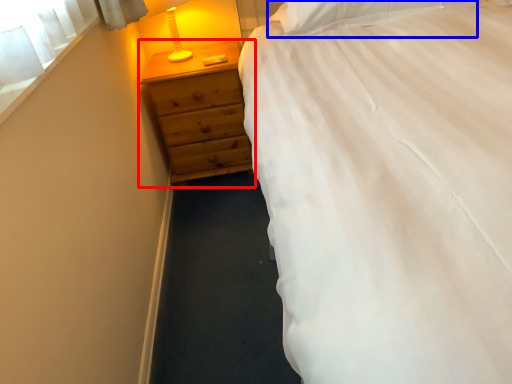
Question: Which object is further to the camera taking this photo, chest of drawers (highlighted by a red box) or pillow (highlighted by a blue box)?

Choices:
 (A) chest of drawers
 (B) pillow

Answer: (A)